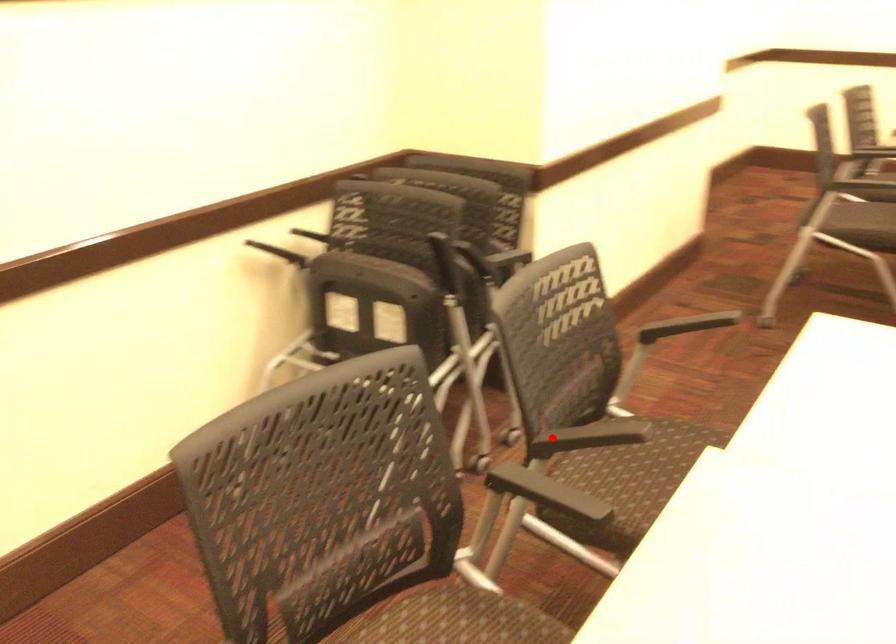
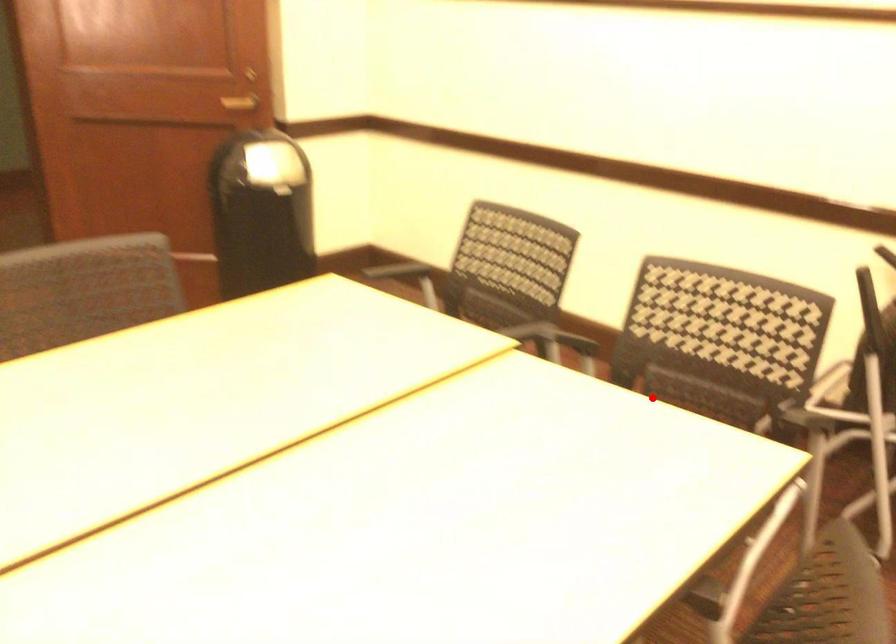
I am providing you with two images of the same scene from different viewpoints. A red point is marked on the first image and another point is marked on the second image. Does the point marked in image1 correspond to the same location as the one in image2?

Yes